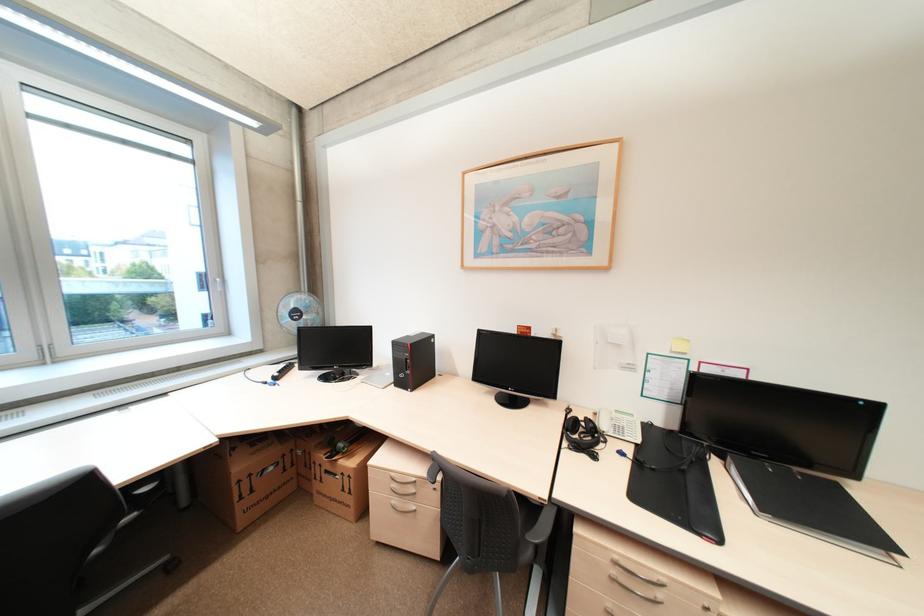
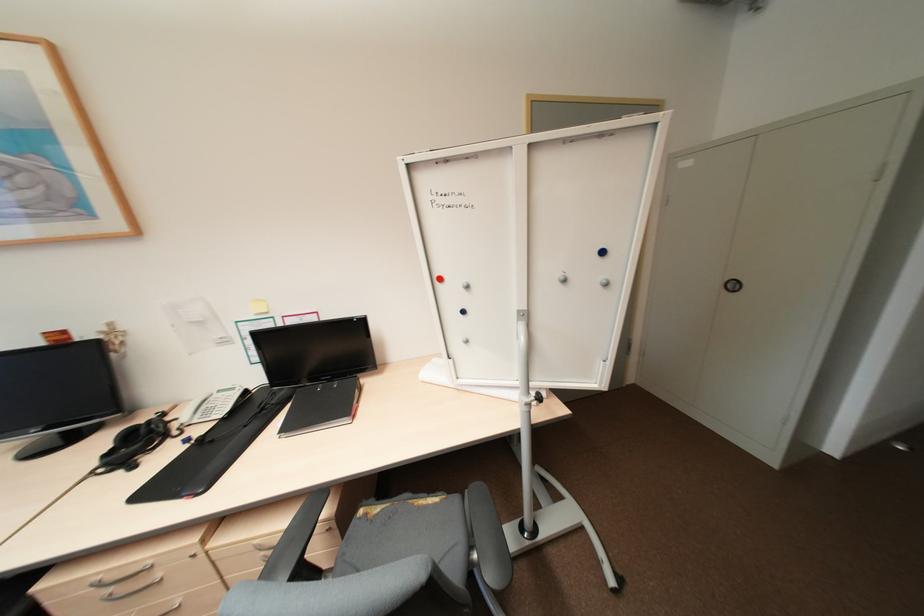
In the second image, find the point that corresponds to [588,435] in the first image.

(142, 444)